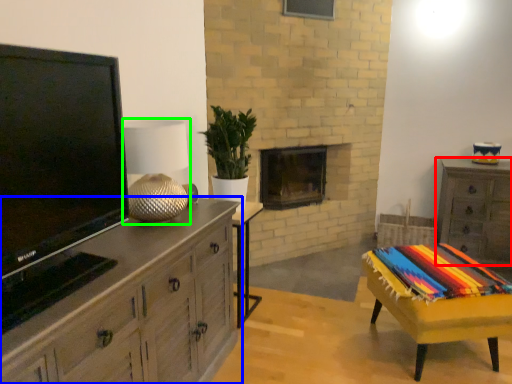
Question: Which object is the farthest from chest of drawers (highlighted by a red box)? Choose among these: chest of drawers (highlighted by a blue box) or lamp (highlighted by a green box).

Choices:
 (A) chest of drawers
 (B) lamp

Answer: (B)